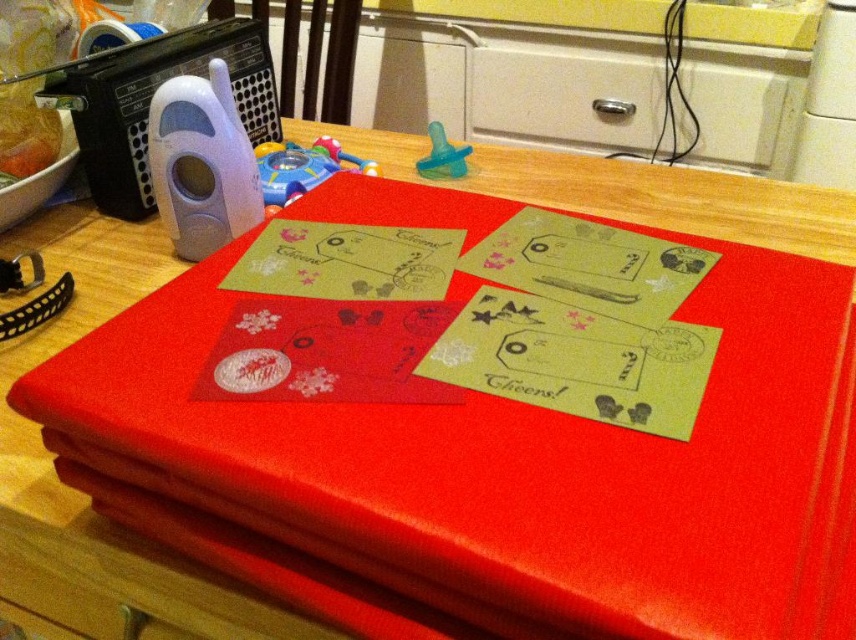
Is point (191, 81) less distant than point (364, 168)?

Yes.

Who is more forward, [165,120] or [349,163]?

Point [165,120] is in front.

Who is more forward, (214, 84) or (330, 154)?

Positioned in front is point (214, 84).

At what (x,y) coordinates should I click in order to perform the action: click on white plastic remote control at upper left. Please return your answer as a coordinate pair (x, y). Looking at the image, I should click on (201, 163).

Can you confirm if white matte drawer at upper center is positioned to the right of translucent plastic toy at center?

Yes, white matte drawer at upper center is to the right of translucent plastic toy at center.

Which is in front, point (657, 68) or point (278, 173)?

Point (278, 173)

In order to click on white matte drawer at upper center in this screenshot , I will do `click(565, 97)`.

Between point (378, 164) and point (321, 148), which one is positioned in front?

Positioned in front is point (321, 148).

Between translucent plastic toy at center and rubberized plastic toy at center, which one is positioned lower?

Positioned lower is translucent plastic toy at center.

What are the coordinates of `translucent plastic toy at center` in the screenshot? It's located at (302, 168).